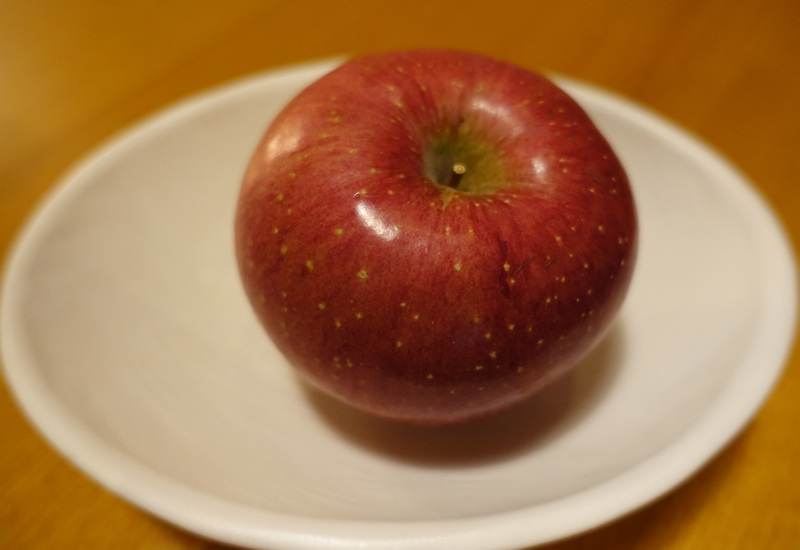
Where is `plate`? plate is located at coordinates (682, 373).